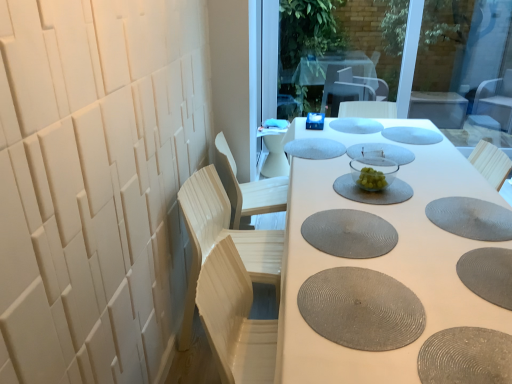
The height and width of the screenshot is (384, 512). I want to click on free area in between clear glass bowl at center, placed as the seventh manhole cover when sorted from front to back, and light blue fabric cushion at center, the third manhole cover when ordered from back to front, so click(333, 154).